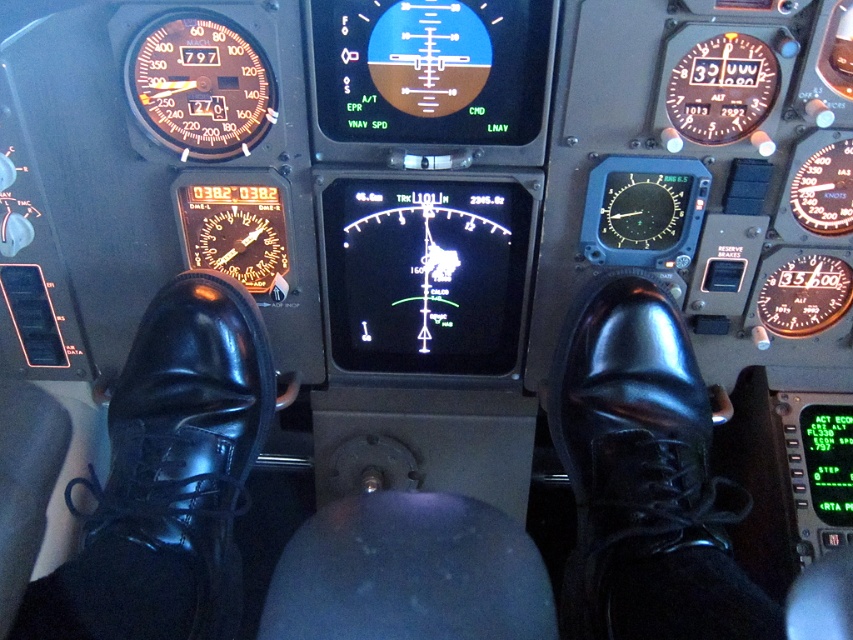
Is black leather shoe at center smaller than shiny black shoe at lower left?

Yes, black leather shoe at center is smaller than shiny black shoe at lower left.

Can you confirm if black leather shoe at center is positioned below shiny black shoe at lower left?

Yes, black leather shoe at center is below shiny black shoe at lower left.

Describe the element at coordinates (643, 477) in the screenshot. I see `black leather shoe at center` at that location.

I want to click on black leather shoe at center, so click(x=643, y=477).